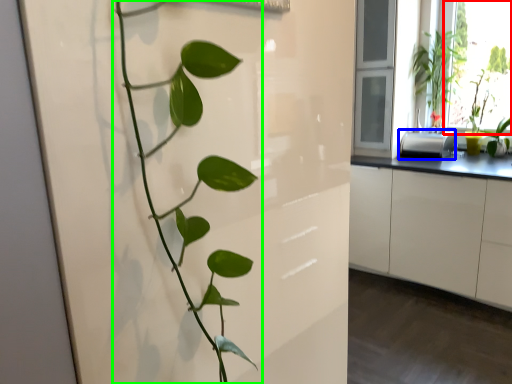
Question: Based on their relative distances, which object is farther from window screen (highlighted by a red box)? Choose from appliance (highlighted by a blue box) and houseplant (highlighted by a green box).

Choices:
 (A) appliance
 (B) houseplant

Answer: (B)